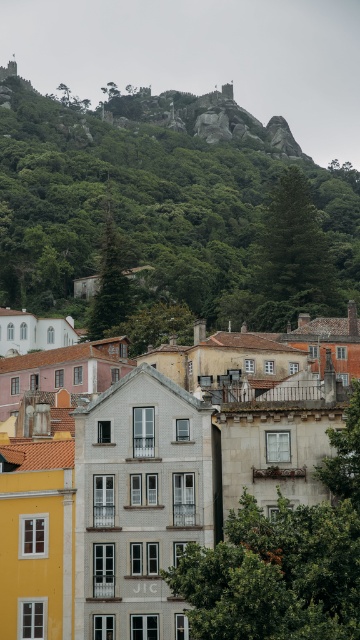
Does white tile building at center have a lesser width compared to green leafy hillside at upper center?

Correct, white tile building at center's width is less than green leafy hillside at upper center's.

Consider the image. Is white tile building at center wider than green leafy hillside at upper center?

In fact, white tile building at center might be narrower than green leafy hillside at upper center.

Between point (132, 476) and point (331, 246), which one is positioned in front?

Point (132, 476) is in front.

I want to click on white tile building at center, so click(x=172, y=465).